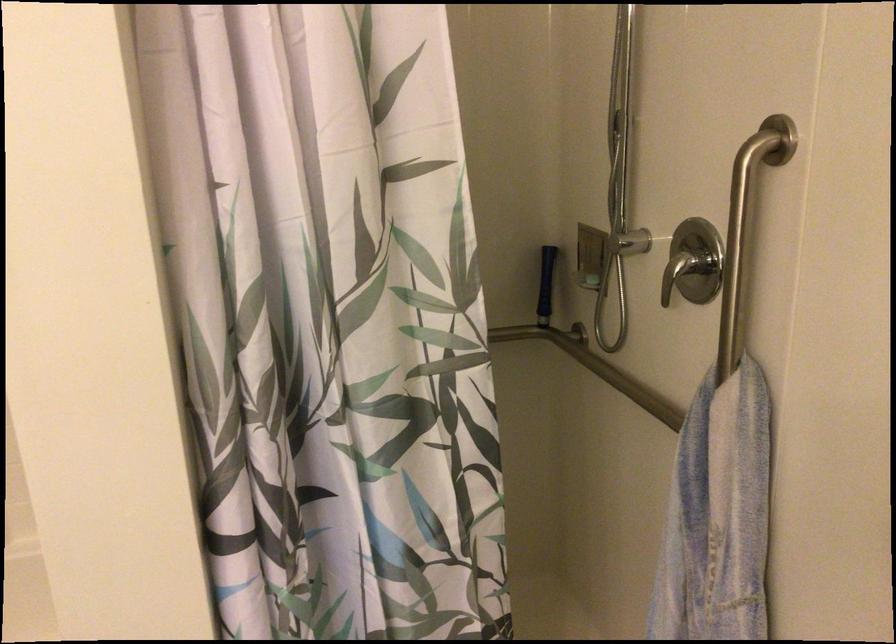
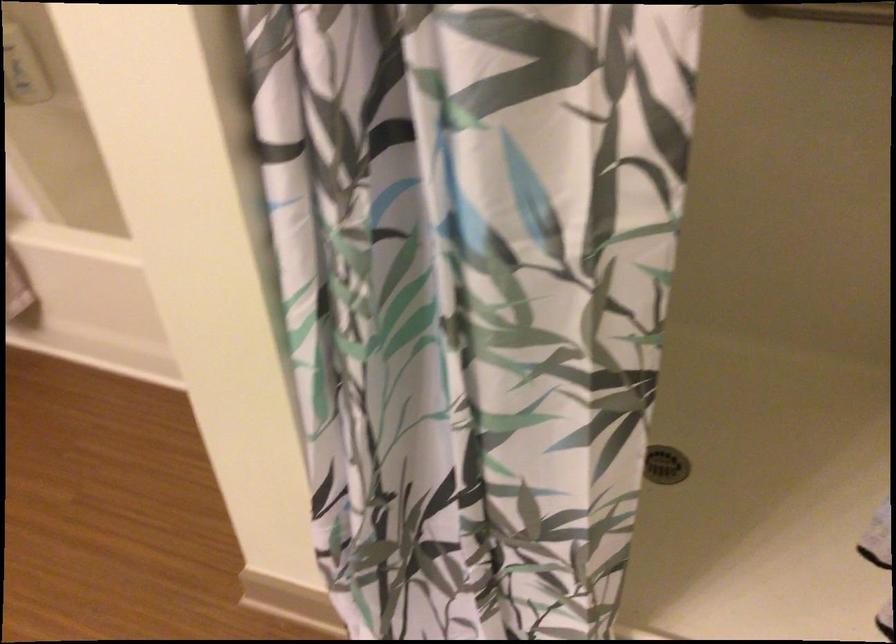
First-person continuous shooting, in which direction is the camera rotating?

The camera rotated toward left-down.